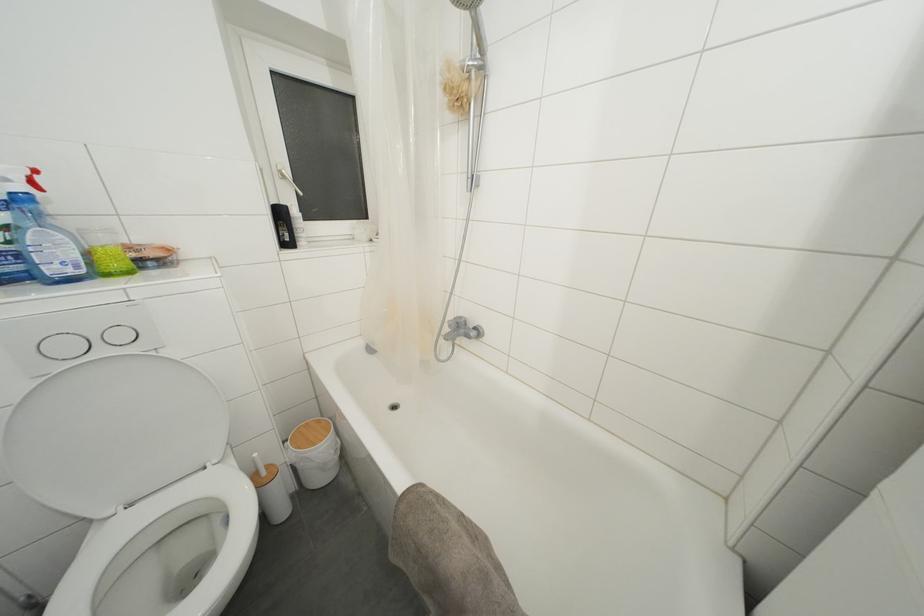
Describe the element at coordinates (455, 320) in the screenshot. The image size is (924, 616). I see `a silver faucet handle` at that location.